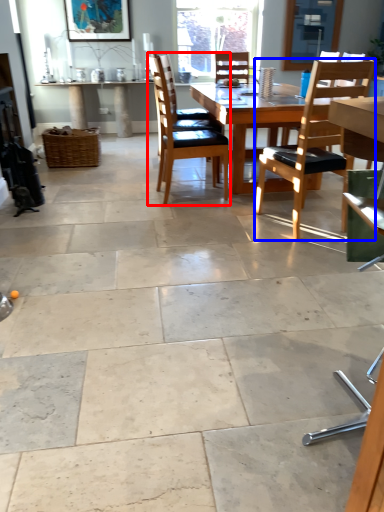
Question: Among these objects, which one is farthest to the camera, chair (highlighted by a red box) or chair (highlighted by a blue box)?

Choices:
 (A) chair
 (B) chair

Answer: (A)